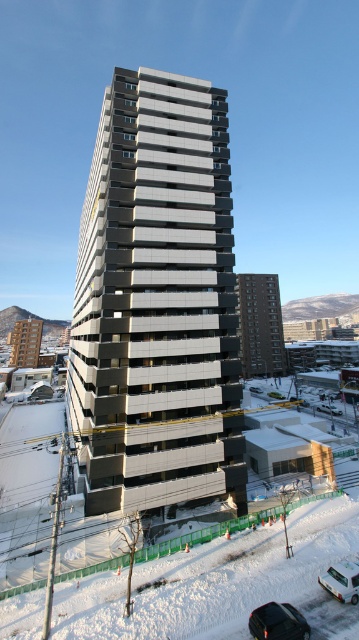
Question: Does metallic gray building at center appear under black glossy car at lower center?

Choices:
 (A) yes
 (B) no

Answer: (B)

Question: Is white powdery snow at lower center closer to the viewer compared to black glossy car at lower center?

Choices:
 (A) no
 (B) yes

Answer: (A)

Question: Can you confirm if white powdery snow at lower center is positioned to the left of black glossy car at lower center?

Choices:
 (A) yes
 (B) no

Answer: (A)

Question: Which object is the closest to the metallic gray building at center?

Choices:
 (A) black glossy car at lower center
 (B) white powdery snow at lower center
 (C) white matte car at lower right

Answer: (B)

Question: Among these objects, which one is nearest to the camera?

Choices:
 (A) white powdery snow at lower center
 (B) metallic gray building at center

Answer: (A)

Question: Which object is positioned closest to the metallic gray building at center?

Choices:
 (A) black glossy car at lower center
 (B) white powdery snow at lower center

Answer: (B)